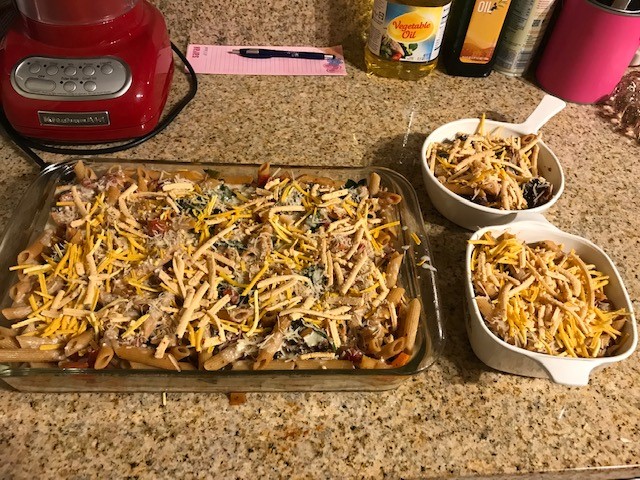
Where is `white baking dishes`? white baking dishes is located at coordinates (445, 206), (488, 342).